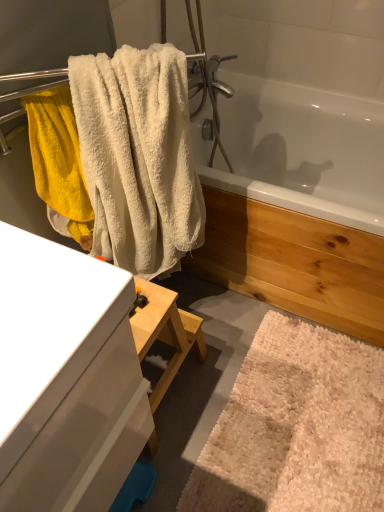
Find the location of a particular element. The height and width of the screenshot is (512, 384). white fluffy bath mat at lower right is located at coordinates (297, 426).

What is the approximate height of white fluffy towel at upper left?

white fluffy towel at upper left is 29.76 inches in height.

You are a GUI agent. You are given a task and a screenshot of the screen. Output one action in this format:
    pyautogui.click(x=<x>, y=<y>)
    Task: Click on the white glossy bathtub at upper center
    
    Given the screenshot: What is the action you would take?
    pyautogui.click(x=297, y=167)

Measure the distance between white glossy cabinet at left and camera.

The distance of white glossy cabinet at left from camera is 52.19 centimeters.

Where is `white fluffy bath mat at lower right`? white fluffy bath mat at lower right is located at coordinates (297, 426).

Is white glossy cabinet at left thinner than white fluffy towel at upper left?

Incorrect, the width of white glossy cabinet at left is not less than that of white fluffy towel at upper left.

Does white glossy cabinet at left lie behind white fluffy towel at upper left?

No, white glossy cabinet at left is closer to the viewer.

Is white glossy cabinet at left outside of white fluffy towel at upper left?

Yes, white glossy cabinet at left is located beyond the bounds of white fluffy towel at upper left.

Can you confirm if white fluffy towel at upper left is bigger than white fluffy bath mat at lower right?

Yes, white fluffy towel at upper left is bigger than white fluffy bath mat at lower right.

From a real-world perspective, is white fluffy towel at upper left physically below white fluffy bath mat at lower right?

No.

Is white fluffy towel at upper left further to the viewer compared to white fluffy bath mat at lower right?

No, white fluffy towel at upper left is in front of white fluffy bath mat at lower right.

Are white fluffy towel at upper left and white fluffy bath mat at lower right beside each other?

No, white fluffy towel at upper left is not touching white fluffy bath mat at lower right.

Is white glossy bathtub at upper center spatially inside white fluffy bath mat at lower right, or outside of it?

white glossy bathtub at upper center is located beyond the bounds of white fluffy bath mat at lower right.

From the image's perspective, between white glossy bathtub at upper center and white fluffy bath mat at lower right, who is located below?

white fluffy bath mat at lower right is shown below in the image.

Can you tell me how much white glossy bathtub at upper center and white fluffy bath mat at lower right differ in facing direction?

The angular difference between white glossy bathtub at upper center and white fluffy bath mat at lower right is 89.4 degrees.

How distant is white glossy cabinet at left from white glossy bathtub at upper center?

white glossy cabinet at left is 1.26 meters from white glossy bathtub at upper center.

Between white glossy cabinet at left and white glossy bathtub at upper center, which one has larger width?

white glossy bathtub at upper center.

Which is more to the right, white glossy cabinet at left or white glossy bathtub at upper center?

Positioned to the right is white glossy bathtub at upper center.

Does point (101, 341) appear closer or farther from the camera than point (223, 184)?

Point (101, 341) is positioned closer to the camera compared to point (223, 184).

Is white glossy cabinet at left not close to white fluffy bath mat at lower right?

No.

Can white fluffy bath mat at lower right be found inside white glossy cabinet at left?

No, white fluffy bath mat at lower right is not surrounded by white glossy cabinet at left.

From a real-world perspective, is white glossy cabinet at left on white fluffy bath mat at lower right?

Yes, from a real-world perspective, white glossy cabinet at left is on top of white fluffy bath mat at lower right.

Is white glossy cabinet at left facing towards white fluffy bath mat at lower right?

No, white glossy cabinet at left is not aimed at white fluffy bath mat at lower right.

Which object is more forward, white fluffy bath mat at lower right or white fluffy towel at upper left?

Positioned in front is white fluffy towel at upper left.

How different are the orientations of white fluffy bath mat at lower right and white fluffy towel at upper left in degrees?

129 degrees.

Between white fluffy bath mat at lower right and white fluffy towel at upper left, which one has larger width?

With larger width is white fluffy bath mat at lower right.

From the image's perspective, which one is positioned higher, white fluffy bath mat at lower right or white fluffy towel at upper left?

white fluffy towel at upper left appears higher in the image.

From a real-world perspective, is white fluffy towel at upper left located higher than white glossy bathtub at upper center?

Yes, from a real-world perspective, white fluffy towel at upper left is over white glossy bathtub at upper center

Would you say white fluffy towel at upper left is a long distance from white glossy bathtub at upper center?

white fluffy towel at upper left is near white glossy bathtub at upper center, not far away.

From the image's perspective, which one is positioned higher, white fluffy towel at upper left or white glossy bathtub at upper center?

white glossy bathtub at upper center, from the image's perspective.

You are a GUI agent. You are given a task and a screenshot of the screen. Output one action in this format:
    pyautogui.click(x=<x>, y=<y>)
    Task: Click on the towel directly beneath the white glossy cabinet at left (from a real-world perspective)
    The image size is (384, 512).
    Given the screenshot: What is the action you would take?
    pyautogui.click(x=138, y=157)

What are the coordinates of `bath mat behind the white fluffy towel at upper left` in the screenshot? It's located at (297, 426).

Considering their positions, is white glossy cabinet at left positioned closer to white fluffy bath mat at lower right than white fluffy towel at upper left?

white glossy cabinet at left.

Estimate the real-world distances between objects in this image. Which object is further from white glossy cabinet at left, white fluffy bath mat at lower right or white fluffy towel at upper left?

Based on the image, white fluffy bath mat at lower right appears to be further to white glossy cabinet at left.

Considering their positions, is white fluffy bath mat at lower right positioned further to white fluffy towel at upper left than white glossy bathtub at upper center?

The object further to white fluffy towel at upper left is white glossy bathtub at upper center.

Based on their spatial positions, is white glossy cabinet at left or white fluffy bath mat at lower right further from white fluffy towel at upper left?

The object further to white fluffy towel at upper left is white fluffy bath mat at lower right.

Estimate the real-world distances between objects in this image. Which object is closer to white fluffy towel at upper left, white fluffy bath mat at lower right or white glossy cabinet at left?

The object closer to white fluffy towel at upper left is white glossy cabinet at left.

Estimate the real-world distances between objects in this image. Which object is closer to white glossy cabinet at left, white fluffy towel at upper left or white glossy bathtub at upper center?

The object closer to white glossy cabinet at left is white fluffy towel at upper left.

Based on their spatial positions, is white glossy cabinet at left or white fluffy bath mat at lower right closer to white glossy bathtub at upper center?

white fluffy bath mat at lower right.

Based on their spatial positions, is white glossy bathtub at upper center or white fluffy towel at upper left further from white fluffy bath mat at lower right?

white glossy bathtub at upper center lies further to white fluffy bath mat at lower right than the other object.

I want to click on towel between white glossy cabinet at left and white glossy bathtub at upper center in the horizontal direction, so click(138, 157).

The height and width of the screenshot is (512, 384). Identify the location of bathroom cabinet between white fluffy towel at upper left and white fluffy bath mat at lower right from top to bottom. point(66,378).

You are a GUI agent. You are given a task and a screenshot of the screen. Output one action in this format:
    pyautogui.click(x=<x>, y=<y>)
    Task: Click on the bath mat between white glossy cabinet at left and white glossy bathtub at upper center
    
    Given the screenshot: What is the action you would take?
    pyautogui.click(x=297, y=426)

I want to click on towel between white glossy bathtub at upper center and white fluffy bath mat at lower right from top to bottom, so click(x=138, y=157).